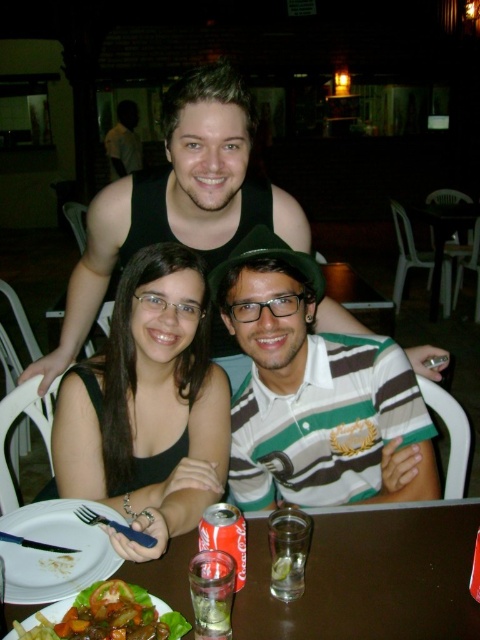
Question: Which of the following is the farthest from the observer?

Choices:
 (A) white matte plate at lower left
 (B) black matte tank top at center

Answer: (B)

Question: Is white matte plate at lower left positioned before clear glass at table center?

Choices:
 (A) no
 (B) yes

Answer: (B)

Question: In this image, where is green striped polo shirt at center located relative to black matte tank top at center?

Choices:
 (A) below
 (B) above

Answer: (B)

Question: Estimate the real-world distances between objects in this image. Which object is farther from the wooden table at center?

Choices:
 (A) clear glass at table center
 (B) green striped polo shirt at center
 (C) black matte tank top at center

Answer: (C)

Question: Is white matte plate at lower left closer to camera compared to green leafy vegetables at lower left?

Choices:
 (A) yes
 (B) no

Answer: (B)

Question: Among these objects, which one is nearest to the camera?

Choices:
 (A) matte black tank top at upper center
 (B) wooden table at center
 (C) clear glass at table center
 (D) white matte plate at lower left

Answer: (B)